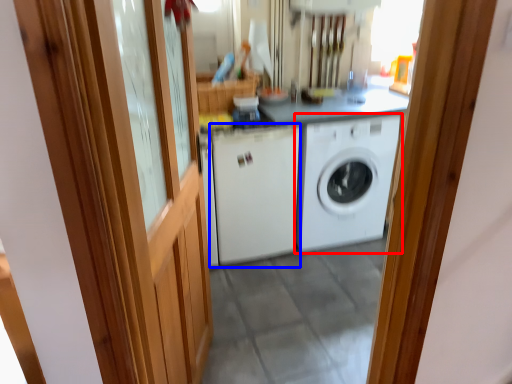
Question: Which object appears farthest to the camera in this image, washing machine (highlighted by a red box) or washing machine (highlighted by a blue box)?

Choices:
 (A) washing machine
 (B) washing machine

Answer: (A)